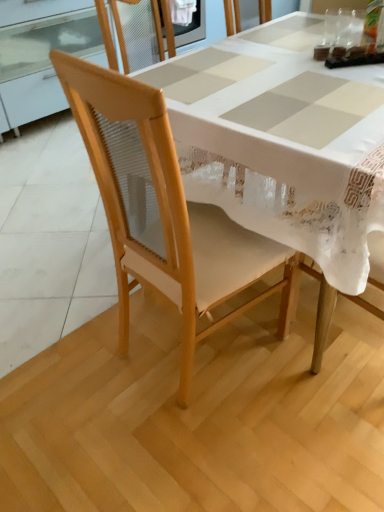
Where is `blank area to the left of natural wood chair at center`? blank area to the left of natural wood chair at center is located at coordinates (81, 351).